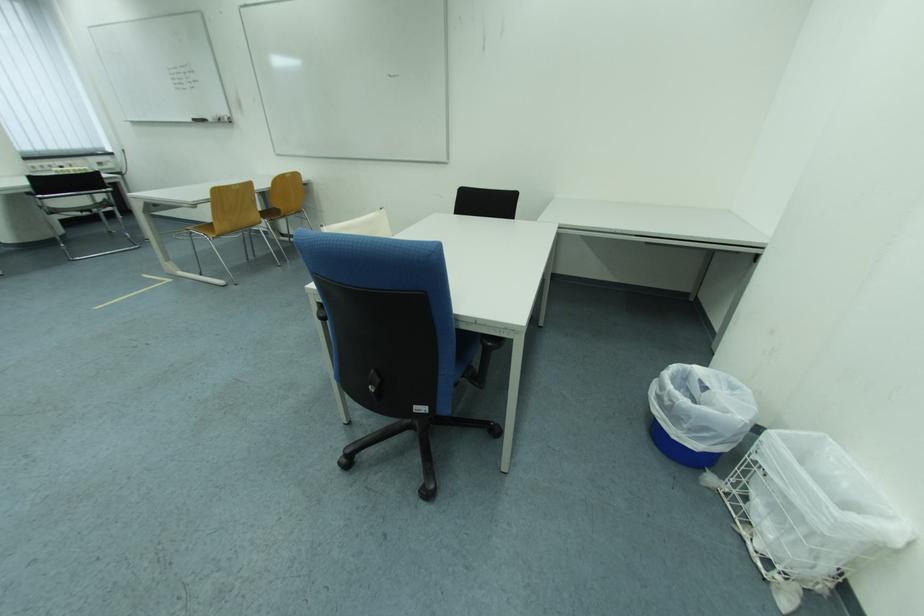
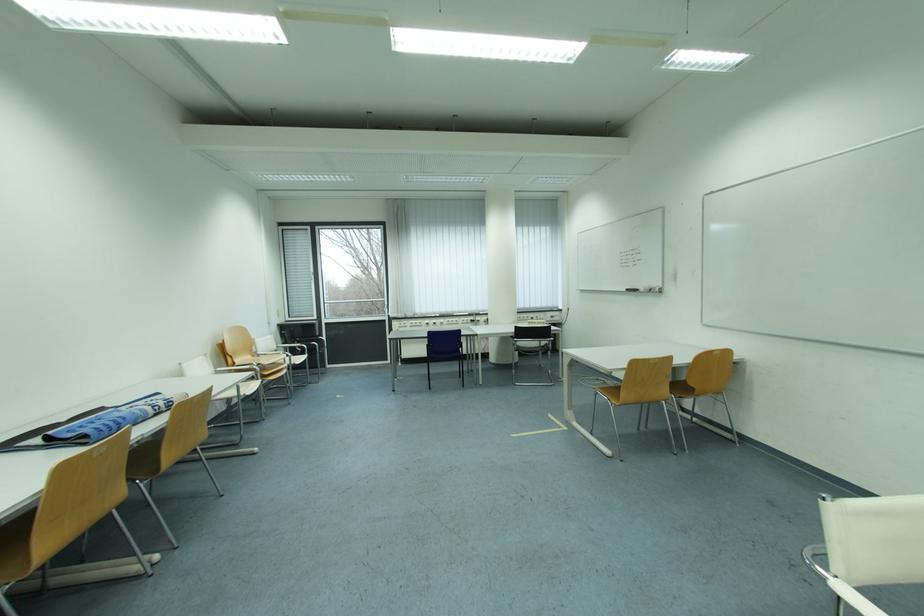
Question: The images are taken continuously from a first-person perspective. In which direction is your viewpoint rotating?

Choices:
 (A) Left
 (B) Right
 (C) Up
 (D) Down

Answer: (A)